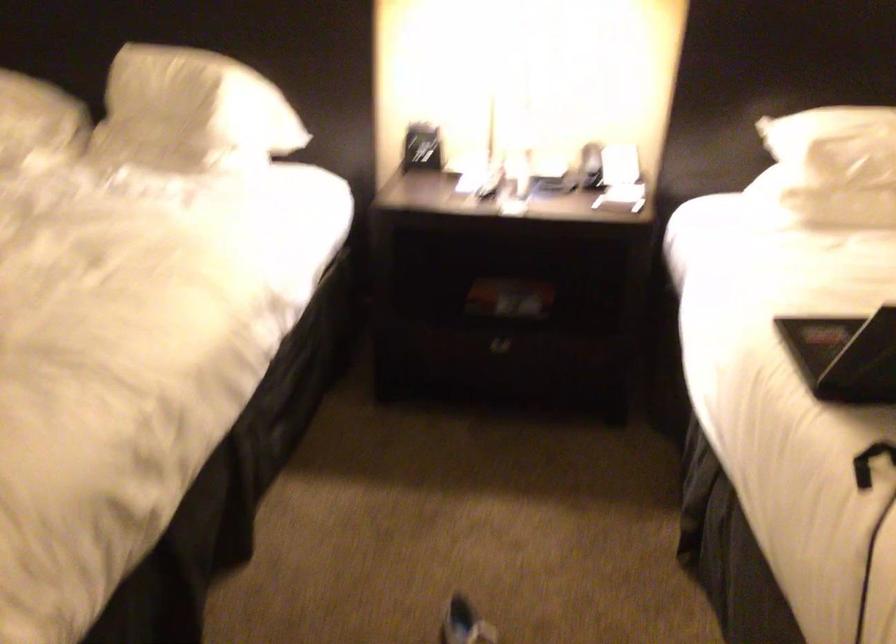
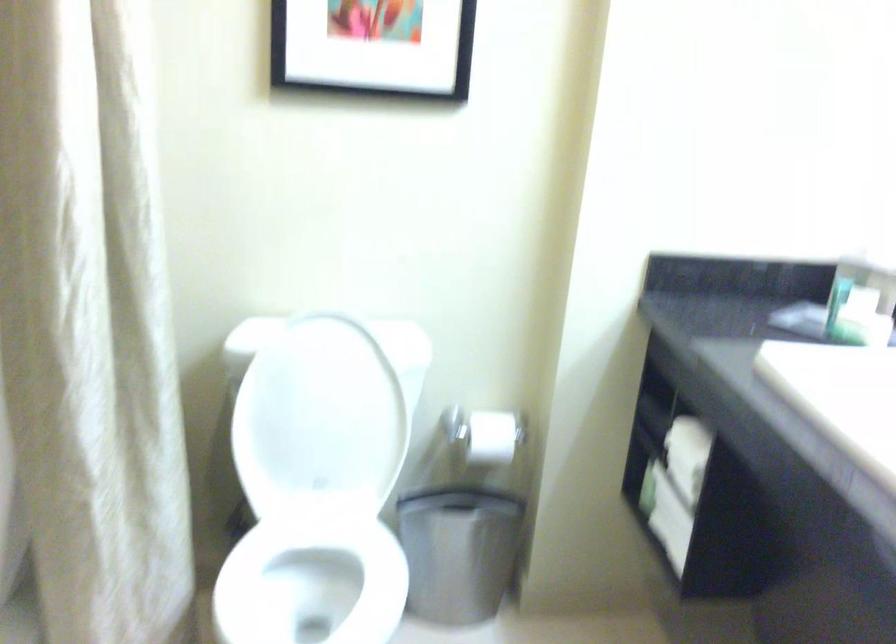
Question: Which direction would the cameraman need to move to produce the second image? Reply with the corresponding letter.

Choices:
 (A) Left
 (B) Right
 (C) Forward
 (D) Backward

Answer: (A)